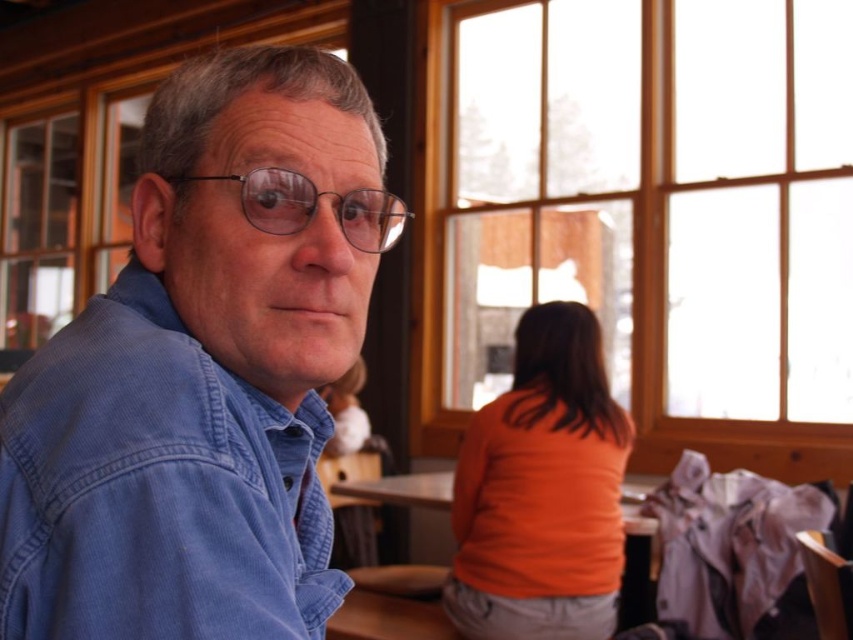
Where is the smooth wooden table at center located in the image?

The smooth wooden table at center is located at point (412, 506) in the image.

You are standing in the wooden interior and want to locate the wooden frame at upper right. According to the coordinates provided, where should you look?

The wooden frame at upper right is located at point (646, 212).

You are a photographer setting up a shoot in this location. You want to position a large camera tripod between the denim shirt at left and the smooth wooden table at center. Is there enough space between them to place the tripod?

The denim shirt at left is in front of the smooth wooden table at center, meaning they are positioned along the same line of sight. Since the denim shirt is closer to the camera than the table, placing a tripod between them would require space in the depth dimension. However, without knowing the exact distance between them, it is impossible to determine if the tripod will fit. Please check the actual distance between the denim shirt at left and the smooth wooden table at center before deciding.